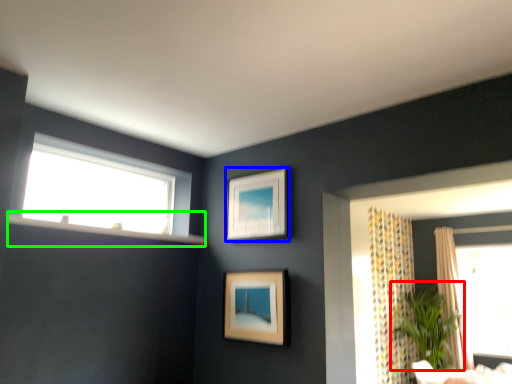
Question: Considering the real-world distances, which object is closest to plant (highlighted by a red box)? picture frame (highlighted by a blue box) or window sill (highlighted by a green box).

Choices:
 (A) picture frame
 (B) window sill

Answer: (A)